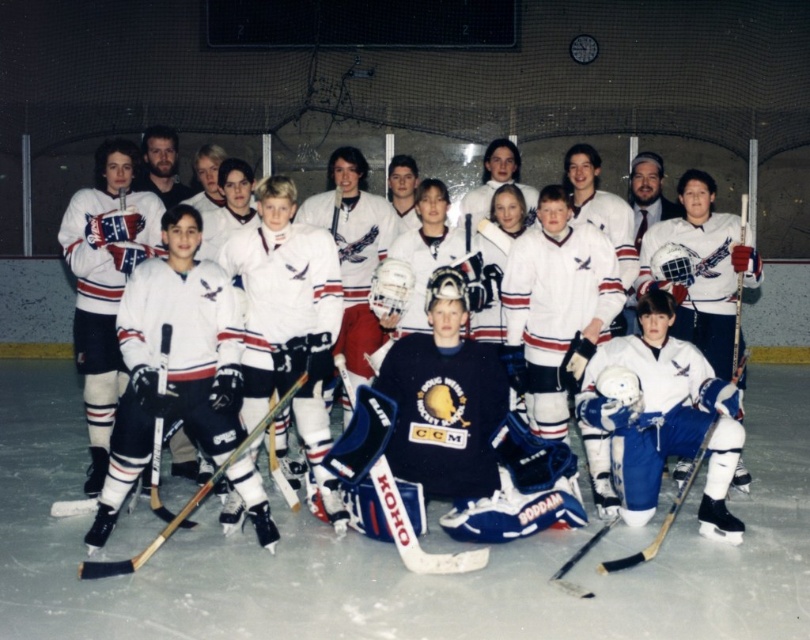
Is point (573, 161) less distant than point (376, 490)?

No, (573, 161) is further to viewer.

Is white matte hockey jerseys at center thinner than blue plastic hockey stick at center?

No.

Where is `white matte hockey jerseys at center`? This screenshot has width=810, height=640. white matte hockey jerseys at center is located at coordinates (602, 208).

Is white matte hockey jerseys at center positioned before wooden hockey stick at center?

No, it is not.

Is point (181, 467) farther from viewer compared to point (282, 400)?

Yes, point (181, 467) is farther from viewer.

Image resolution: width=810 pixels, height=640 pixels. I want to click on white matte hockey jerseys at center, so click(602, 208).

Does blue plastic hockey stick at center have a larger size compared to wooden hockey stick at center?

Actually, blue plastic hockey stick at center might be smaller than wooden hockey stick at center.

Between point (377, 483) and point (87, 564), which one is positioned in front?

Positioned in front is point (87, 564).

Which is in front, point (442, 560) or point (92, 576)?

Positioned in front is point (92, 576).

Identify the location of blue plastic hockey stick at center. (414, 534).